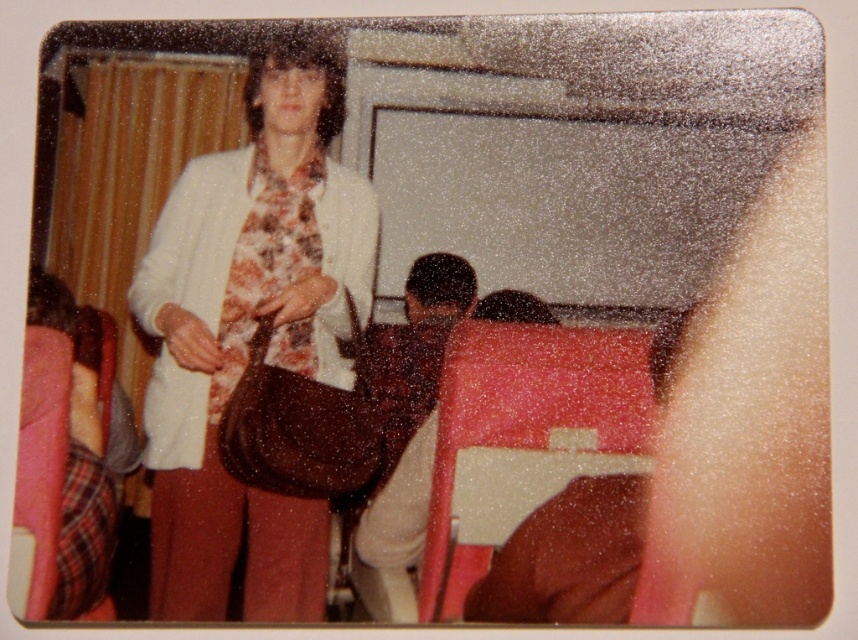
Question: Which object appears closest to the camera in this image?

Choices:
 (A) floral fabric tie at center
 (B) smooth brown leather bag at lower right
 (C) matte brown purse at center

Answer: (B)

Question: Is smooth brown leather bag at lower right positioned behind floral fabric tie at center?

Choices:
 (A) no
 (B) yes

Answer: (A)

Question: Which of the following is the closest to the observer?

Choices:
 (A) (264, 179)
 (B) (530, 588)
 (C) (275, 182)

Answer: (B)

Question: Does matte brown purse at center have a lesser width compared to floral fabric tie at center?

Choices:
 (A) yes
 (B) no

Answer: (B)

Question: Which is farther from the floral fabric tie at center?

Choices:
 (A) matte brown purse at center
 (B) smooth brown leather bag at lower right

Answer: (B)

Question: Can you confirm if matte brown purse at center is positioned above floral fabric tie at center?

Choices:
 (A) no
 (B) yes

Answer: (A)